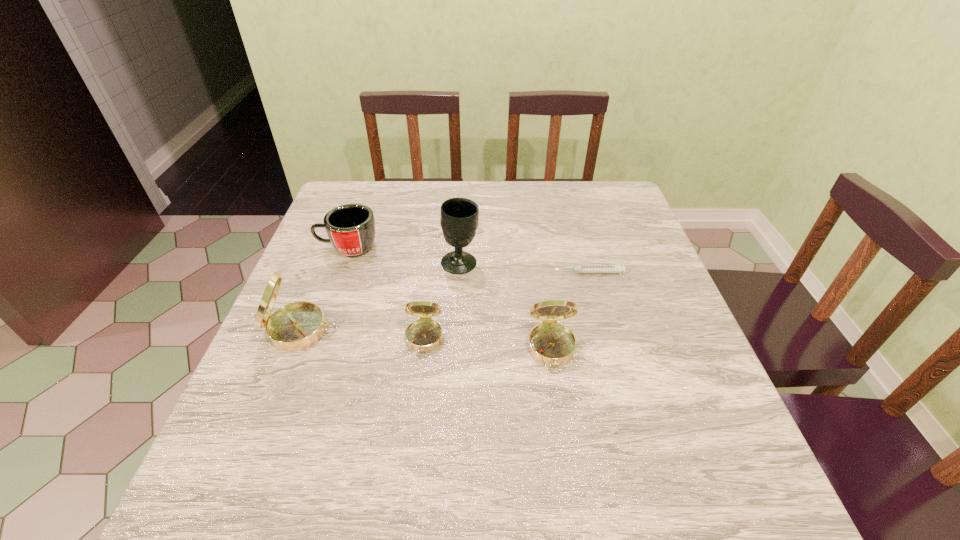
In order to click on free spot at the right edge of the desktop in this screenshot , I will do `click(639, 306)`.

Find the location of a particular element. The height and width of the screenshot is (540, 960). vacant space at the far left corner of the desktop is located at coordinates (376, 218).

Where is `empty location between the leftmost compass and the mug`? empty location between the leftmost compass and the mug is located at coordinates (324, 289).

The height and width of the screenshot is (540, 960). I want to click on vacant space that's between the chalice and the second compass from right to left, so click(x=442, y=301).

Identify the location of vacant region between the syringe and the chalice. This screenshot has height=540, width=960. (524, 268).

You are a GUI agent. You are given a task and a screenshot of the screen. Output one action in this format:
    pyautogui.click(x=<x>, y=<y>)
    Task: Click on the free space that is in between the mug and the shortest compass
    The width and height of the screenshot is (960, 540).
    Given the screenshot: What is the action you would take?
    pyautogui.click(x=386, y=293)

The image size is (960, 540). Identify the location of vacant space that is in between the shortest compass and the tallest compass. (363, 335).

Locate an element on the screen. The image size is (960, 540). vacant point located between the shortest compass and the rightmost compass is located at coordinates (488, 345).

The image size is (960, 540). What are the coordinates of `blank region between the leftmost compass and the chalice` in the screenshot? It's located at (381, 296).

Where is `object that is the closest to the mug`? object that is the closest to the mug is located at coordinates (459, 220).